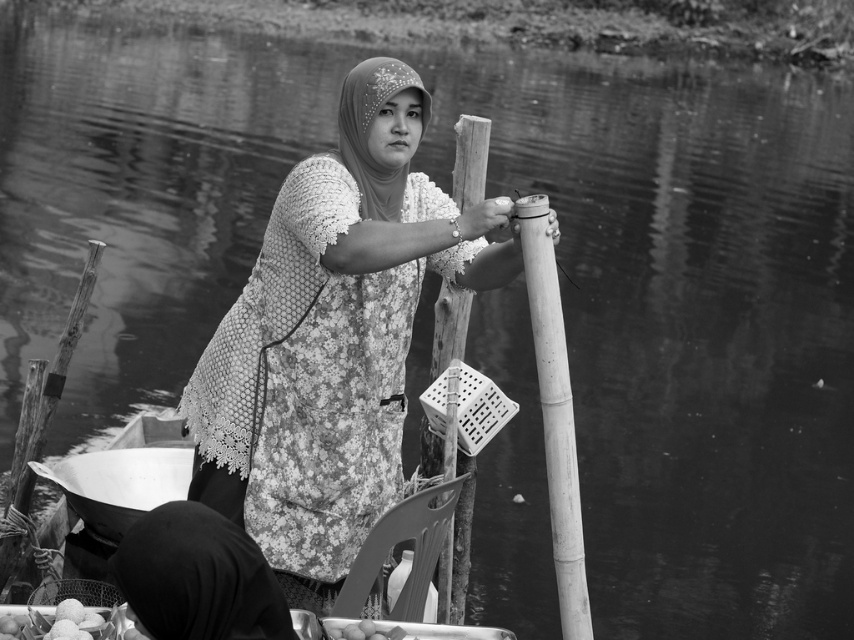
You are a photographer observing the scene. You notice the black lace dress at lower center and the smooth bamboo pole at center. Which object is positioned to the right side of the other?

The smooth bamboo pole at center is to the right of the black lace dress at lower center.